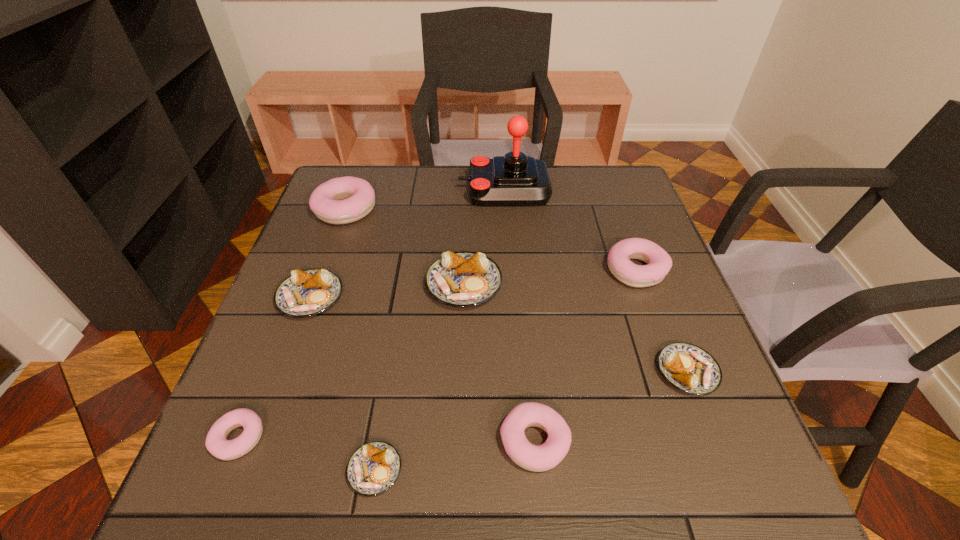
I want to click on the smallest pink pastry, so click(216, 443).

This screenshot has height=540, width=960. I want to click on the smallest brown pastry, so click(373, 468).

The height and width of the screenshot is (540, 960). I want to click on the nearest brown pastry, so click(373, 468).

This screenshot has width=960, height=540. I want to click on free space located 0.210m on the base of the joystick, so tap(389, 190).

Find the location of `free space located on the base of the joystick`. free space located on the base of the joystick is located at coordinates (389, 190).

Where is `vacant space located 0.230m on the base of the joystick`? The height and width of the screenshot is (540, 960). vacant space located 0.230m on the base of the joystick is located at coordinates (382, 190).

Identify the location of free space located 0.080m on the front of the farthest pastry. (331, 249).

Identify the location of free spot located on the left of the second brown pastry from right to left. This screenshot has height=540, width=960. (400, 284).

Identify the location of free space located on the left of the third smallest pink pastry. (540, 269).

Where is `free space located on the front of the leftmost brown pastry`? This screenshot has height=540, width=960. free space located on the front of the leftmost brown pastry is located at coordinates (267, 416).